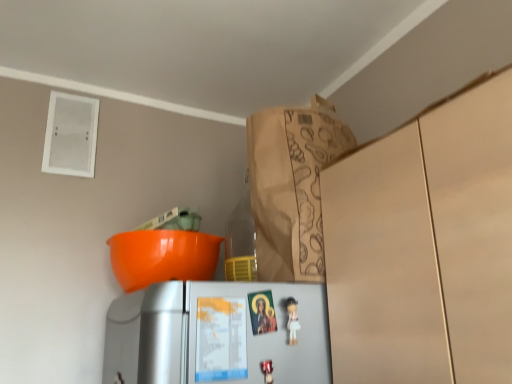
Question: From a real-world perspective, is white matte refrigerator at lower center located beneath brown paper bag at upper center?

Choices:
 (A) yes
 (B) no

Answer: (A)

Question: From the image's perspective, is white matte refrigerator at lower center under brown paper bag at upper center?

Choices:
 (A) no
 (B) yes

Answer: (B)

Question: Is white matte refrigerator at lower center smaller than brown paper bag at upper center?

Choices:
 (A) yes
 (B) no

Answer: (A)

Question: Could you tell me if white matte refrigerator at lower center is facing brown paper bag at upper center?

Choices:
 (A) no
 (B) yes

Answer: (A)

Question: Does white matte refrigerator at lower center have a lesser height compared to brown paper bag at upper center?

Choices:
 (A) yes
 (B) no

Answer: (A)

Question: Is white glossy figurine at center inside the boundaries of white matte refrigerator at lower center, or outside?

Choices:
 (A) outside
 (B) inside

Answer: (B)

Question: Looking at their shapes, would you say white glossy figurine at center is wider or thinner than white matte refrigerator at lower center?

Choices:
 (A) wide
 (B) thin

Answer: (A)

Question: Is white glossy figurine at center to the left or to the right of white matte refrigerator at lower center in the image?

Choices:
 (A) right
 (B) left

Answer: (A)

Question: In the image, is white glossy figurine at center positioned in front of or behind white matte refrigerator at lower center?

Choices:
 (A) behind
 (B) front

Answer: (A)

Question: From a real-world perspective, is brown paper bag at upper center positioned above or below white glossy figurine at center?

Choices:
 (A) above
 (B) below

Answer: (A)

Question: From the image's perspective, relative to white glossy figurine at center, is brown paper bag at upper center above or below?

Choices:
 (A) above
 (B) below

Answer: (A)

Question: Considering the positions of brown paper bag at upper center and white glossy figurine at center in the image, is brown paper bag at upper center wider or thinner than white glossy figurine at center?

Choices:
 (A) wide
 (B) thin

Answer: (A)

Question: In terms of height, does brown paper bag at upper center look taller or shorter compared to white glossy figurine at center?

Choices:
 (A) tall
 (B) short

Answer: (A)

Question: From a real-world perspective, is brown paper bag at upper center positioned above or below white matte refrigerator at lower center?

Choices:
 (A) below
 (B) above

Answer: (B)

Question: From the image's perspective, is brown paper bag at upper center positioned above or below white matte refrigerator at lower center?

Choices:
 (A) below
 (B) above

Answer: (B)